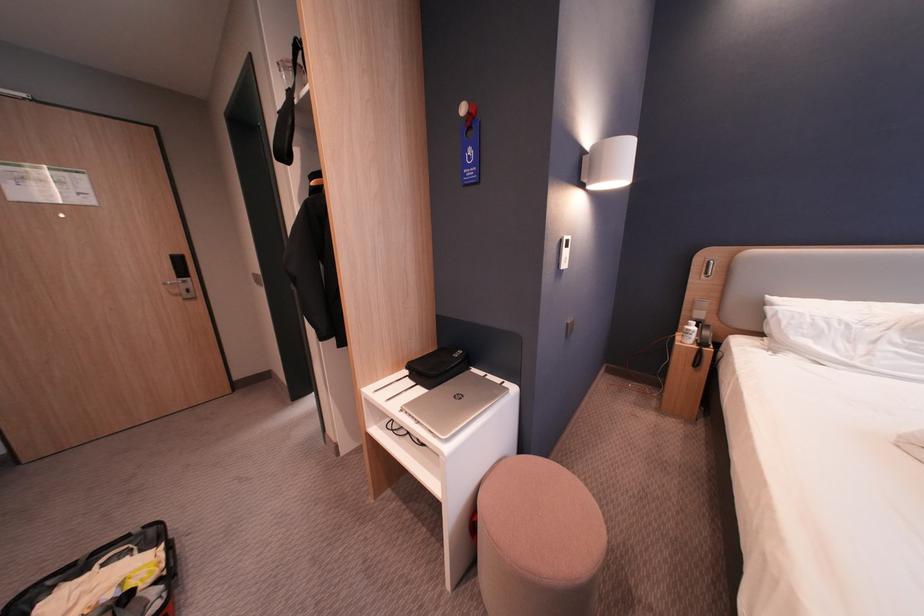
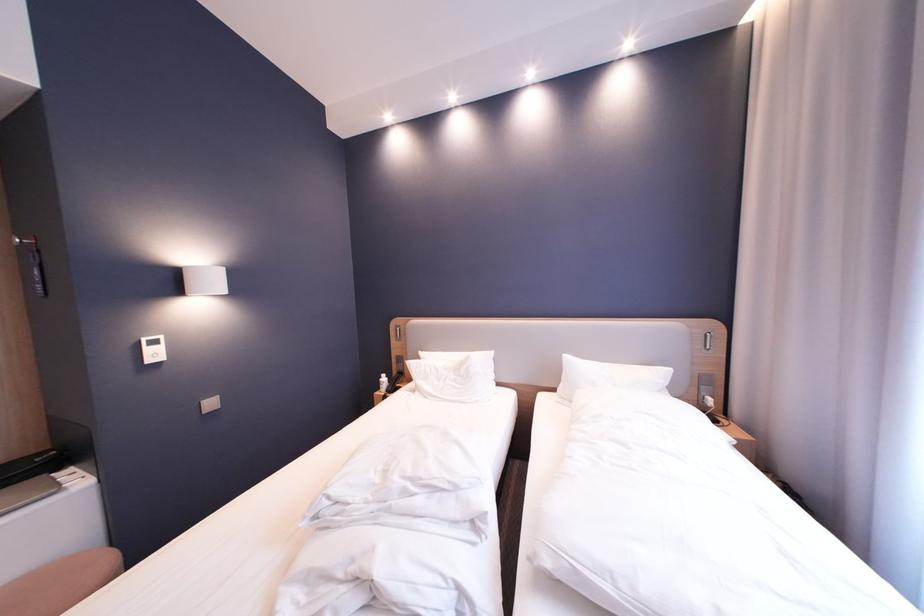
Find the pixel in the second image that matches [861,342] in the first image.

(450, 382)